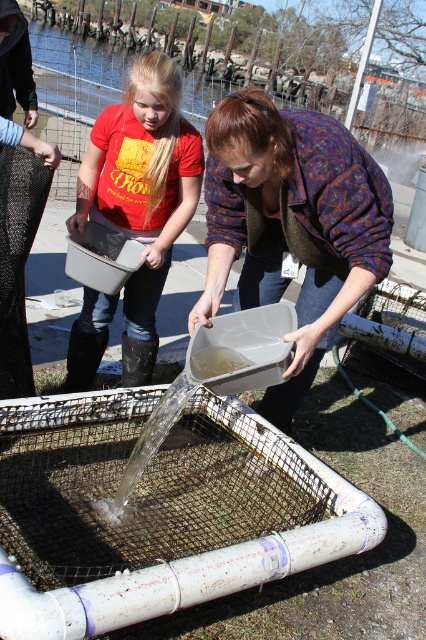
Question: Is matte plastic tray at center smaller than matte plastic bucket at left?

Choices:
 (A) no
 (B) yes

Answer: (A)

Question: Which point is closer to the camera?

Choices:
 (A) (301, 298)
 (B) (143, 288)

Answer: (A)

Question: In this image, where is matte plastic tray at center located relative to matte plastic bucket at left?

Choices:
 (A) right
 (B) left

Answer: (A)

Question: Which object appears closest to the camera in this image?

Choices:
 (A) matte plastic bucket at left
 (B) matte plastic tray at center

Answer: (B)

Question: Is matte plastic tray at center positioned before matte plastic bucket at left?

Choices:
 (A) no
 (B) yes

Answer: (B)